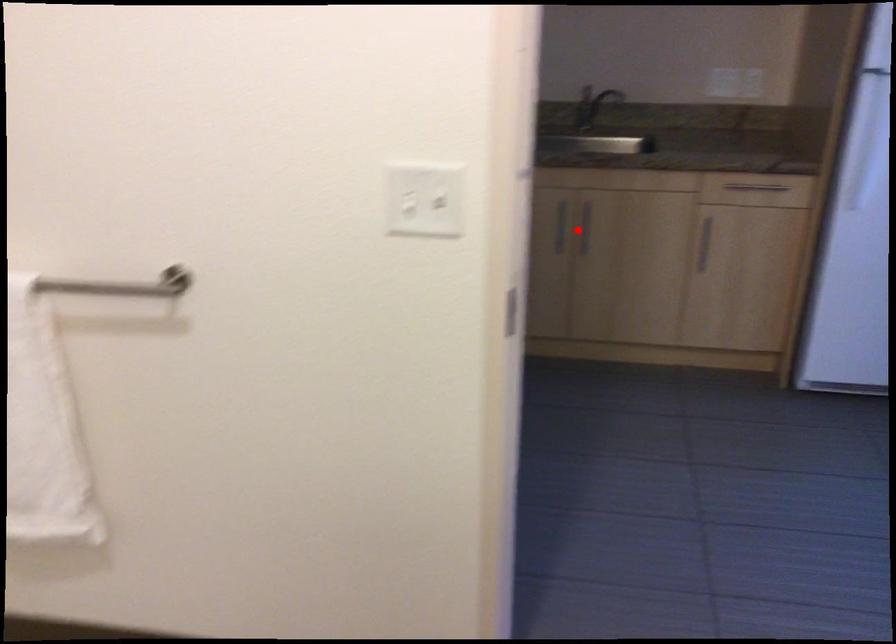
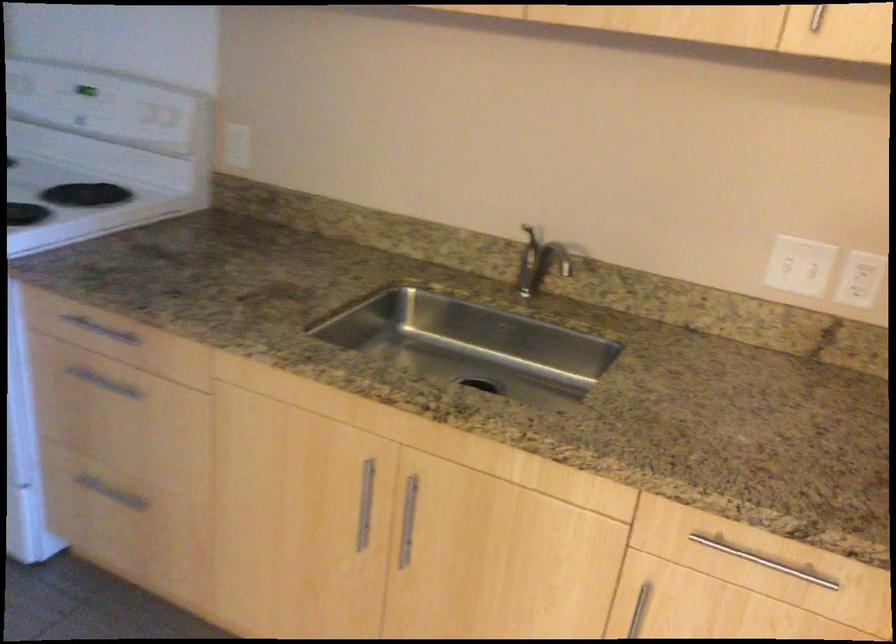
Where in the second image is the point corresponding to the highlighted location from the first image?

(408, 520)